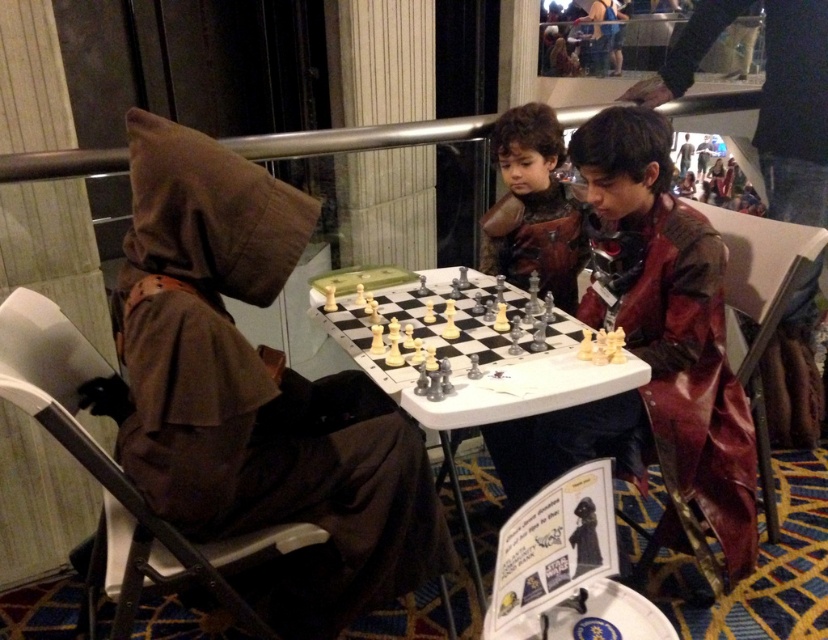
Question: Where is brown leather armor at center located in relation to metallic chess set at center in the image?

Choices:
 (A) above
 (B) below

Answer: (A)

Question: Estimate the real-world distances between objects in this image. Which object is farther from the metallic chess set at center?

Choices:
 (A) brown fabric hood at upper left
 (B) brown leather armor at center

Answer: (B)

Question: Based on their relative distances, which object is nearer to the brown leather armor at center?

Choices:
 (A) brown fabric hood at upper left
 (B) metallic chess set at center

Answer: (B)

Question: Can you confirm if brown fabric hood at upper left is bigger than brown leather armor at center?

Choices:
 (A) no
 (B) yes

Answer: (B)

Question: Which is farther from the brown leather armor at center?

Choices:
 (A) brown fabric hood at upper left
 (B) metallic chess set at center

Answer: (A)

Question: Is brown leather armor at center positioned at the back of metallic chess set at center?

Choices:
 (A) no
 (B) yes

Answer: (B)